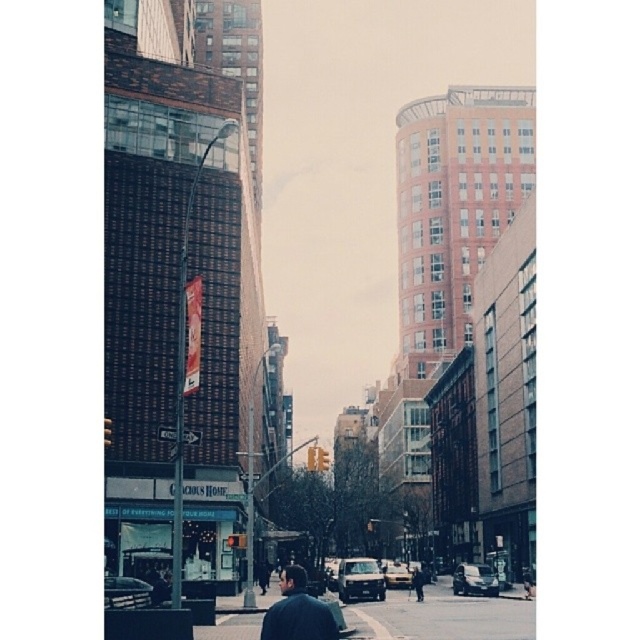
Is smooth asphalt road at center bigger than dark blue jacket at center?

Yes, smooth asphalt road at center is bigger than dark blue jacket at center.

Does smooth asphalt road at center appear over dark blue jacket at center?

No.

Does point (353, 604) lie behind point (330, 634)?

That is True.

The width and height of the screenshot is (640, 640). In order to click on smooth asphalt road at center in this screenshot , I will do `click(444, 616)`.